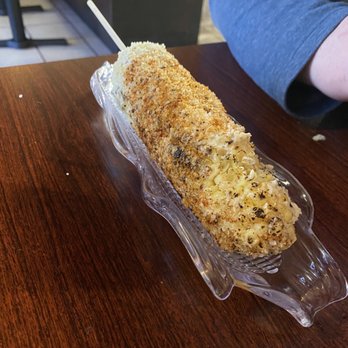
Find the location of a particular element. This screenshot has width=348, height=348. top of clear glass dish is located at coordinates [103, 74].